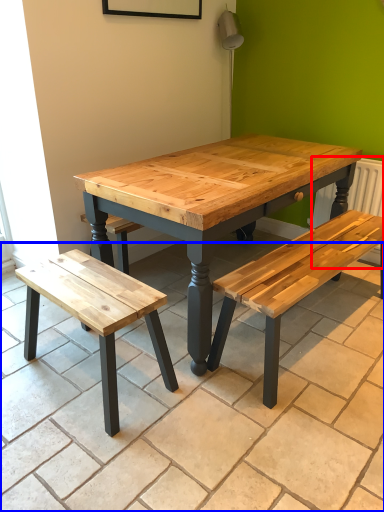
Question: Which point is closer to the camera, radiator (highlighted by a red box) or tile (highlighted by a blue box)?

Choices:
 (A) radiator
 (B) tile

Answer: (B)